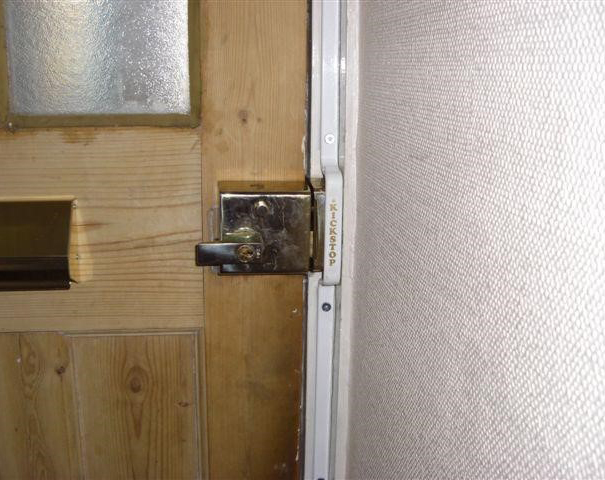
This screenshot has width=605, height=480. Find the location of `mail slot`. mail slot is located at coordinates click(x=10, y=252).